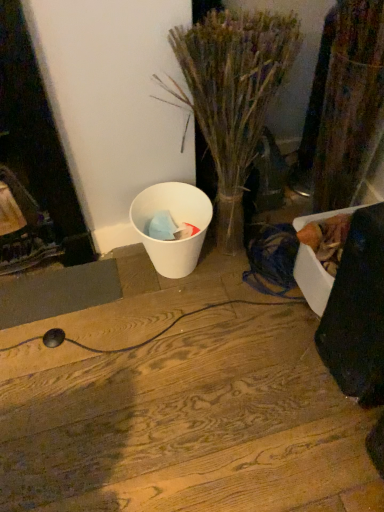
Question: Is translucent glass vase at center further to the viewer compared to white matte trash can at lower left?

Choices:
 (A) no
 (B) yes

Answer: (A)

Question: From a real-world perspective, is translucent glass vase at center physically below white matte trash can at lower left?

Choices:
 (A) no
 (B) yes

Answer: (A)

Question: Does translucent glass vase at center appear on the right side of white matte trash can at lower left?

Choices:
 (A) yes
 (B) no

Answer: (A)

Question: Is translucent glass vase at center turned away from white matte trash can at lower left?

Choices:
 (A) no
 (B) yes

Answer: (A)

Question: Is translucent glass vase at center outside white matte trash can at lower left?

Choices:
 (A) yes
 (B) no

Answer: (A)

Question: Does point (84, 379) appear closer or farther from the camera than point (249, 162)?

Choices:
 (A) closer
 (B) farther

Answer: (A)

Question: In terms of width, does wooden floor at center look wider or thinner when compared to translucent glass vase at center?

Choices:
 (A) wide
 (B) thin

Answer: (A)

Question: Do you think wooden floor at center is within translucent glass vase at center, or outside of it?

Choices:
 (A) inside
 (B) outside

Answer: (B)

Question: Based on their positions, is wooden floor at center located to the left or right of translucent glass vase at center?

Choices:
 (A) left
 (B) right

Answer: (A)

Question: From the image's perspective, is white matte trash can at lower left located above or below wooden floor at center?

Choices:
 (A) below
 (B) above

Answer: (B)

Question: Is white matte trash can at lower left to the left or to the right of wooden floor at center in the image?

Choices:
 (A) right
 (B) left

Answer: (A)

Question: Is point (172, 246) closer or farther from the camera than point (66, 449)?

Choices:
 (A) farther
 (B) closer

Answer: (A)

Question: Is white matte trash can at lower left wider or thinner than wooden floor at center?

Choices:
 (A) thin
 (B) wide

Answer: (A)

Question: Considering the positions of white matte trash can at lower left and translucent glass vase at center in the image, is white matte trash can at lower left bigger or smaller than translucent glass vase at center?

Choices:
 (A) small
 (B) big

Answer: (A)

Question: Considering their positions, is white matte trash can at lower left located in front of or behind translucent glass vase at center?

Choices:
 (A) front
 (B) behind

Answer: (B)